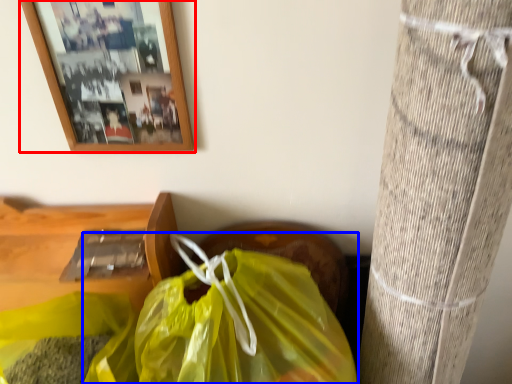
Question: Which point is closer to the camera, picture frame (highlighted by a red box) or plastic bag (highlighted by a blue box)?

Choices:
 (A) picture frame
 (B) plastic bag

Answer: (B)